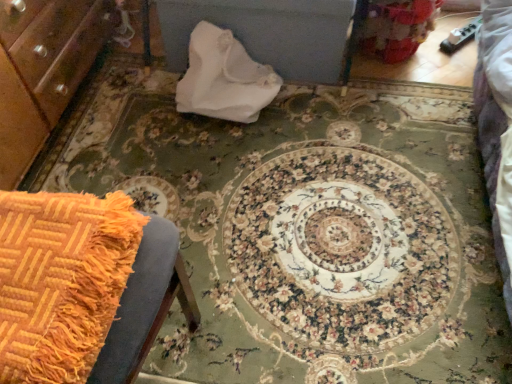
What are the coordinates of `vacant region above orange woven blanket at lower left (from a real-world perspective)` in the screenshot? It's located at (44, 264).